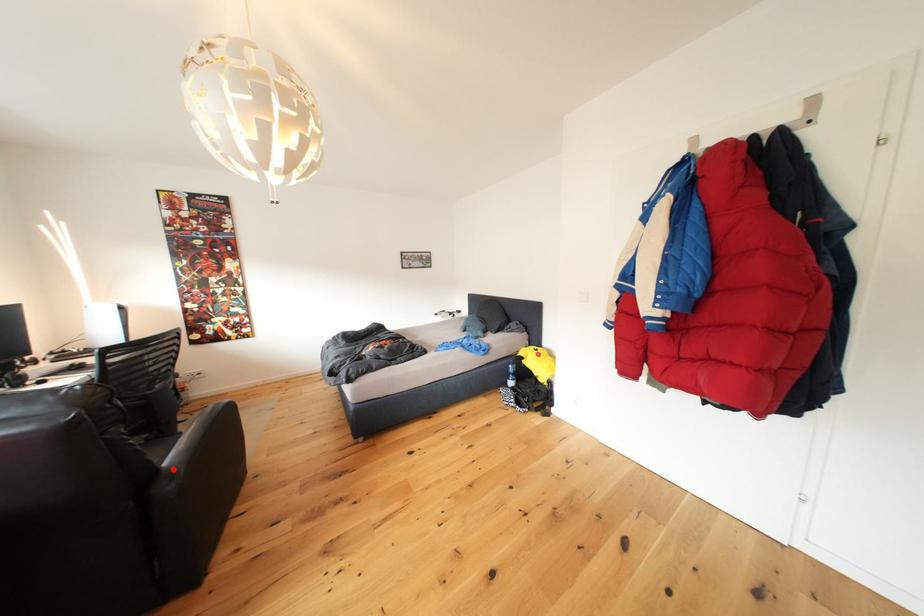
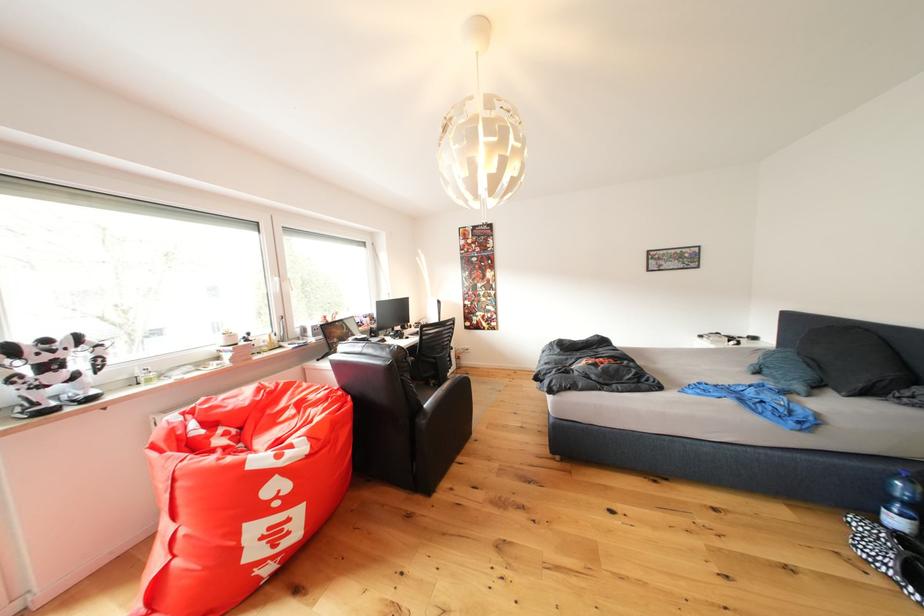
Find the pixel in the second image that matches the highlighted location in the first image.

(434, 410)